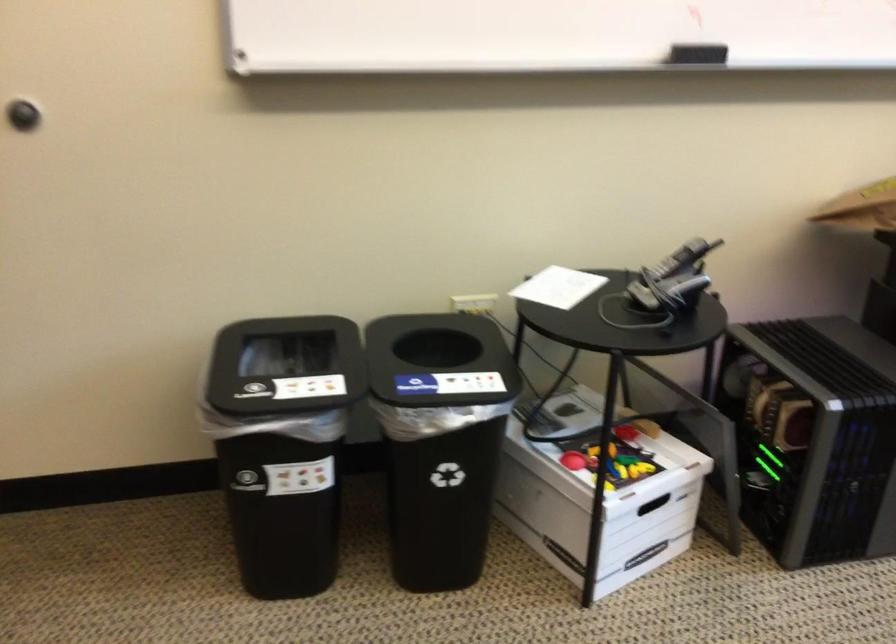
Find where to lift the grey handheld device. Please return your answer as a coordinate pair (x, y).

(813, 436)